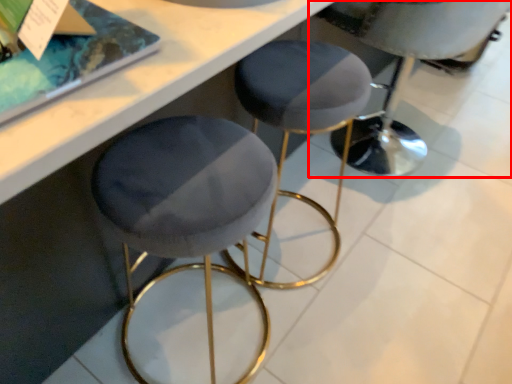
Question: From the image's perspective, what is the correct spatial relationship of swivel chair (annotated by the red box) in relation to stool?

Choices:
 (A) below
 (B) above

Answer: (B)